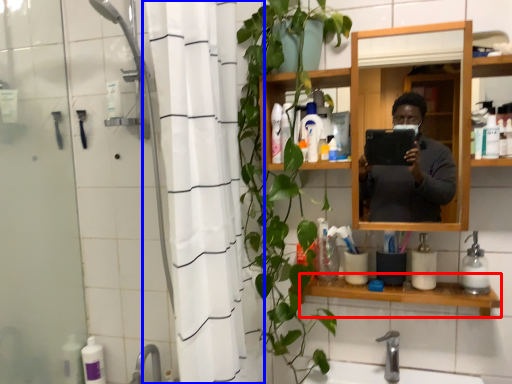
Question: Which object is further to the camera taking this photo, shelve (highlighted by a red box) or shower curtain (highlighted by a blue box)?

Choices:
 (A) shelve
 (B) shower curtain

Answer: (A)